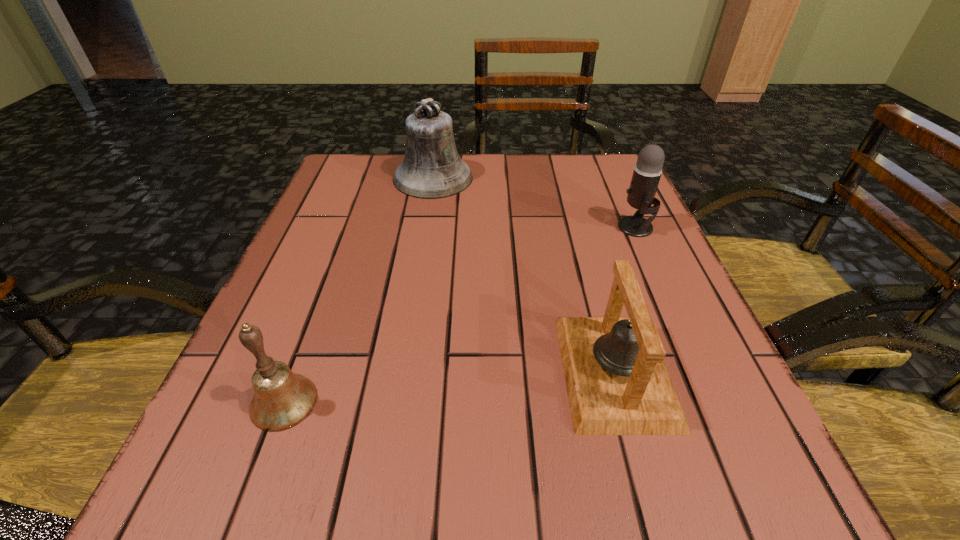
I want to click on vacant space at the near right corner of the desktop, so click(782, 513).

Find the location of a particular element. free space between the tallest bell and the leftmost object is located at coordinates (359, 290).

Image resolution: width=960 pixels, height=540 pixels. I want to click on free point between the third object from right to left and the leftmost bell, so click(359, 290).

You are a GUI agent. You are given a task and a screenshot of the screen. Output one action in this format:
    pyautogui.click(x=<x>, y=<y>)
    Task: Click on the vacant space that's between the second bell from right to left and the third nearest object
    
    Given the screenshot: What is the action you would take?
    pyautogui.click(x=535, y=202)

At what (x,y) coordinates should I click in order to perform the action: click on free point between the leftmost bell and the third nearest object. Please return your answer as a coordinate pair (x, y). The height and width of the screenshot is (540, 960). Looking at the image, I should click on (460, 315).

Locate an element on the screen. This screenshot has height=540, width=960. vacant space in between the leftmost bell and the microphone is located at coordinates (460, 315).

You are a GUI agent. You are given a task and a screenshot of the screen. Output one action in this format:
    pyautogui.click(x=<x>, y=<y>)
    Task: Click on the blank region between the microphone and the second bell from left to right
    Image resolution: width=960 pixels, height=540 pixels.
    Given the screenshot: What is the action you would take?
    pyautogui.click(x=535, y=202)

Identify the location of free space between the farthest bell and the third object from left to right. This screenshot has height=540, width=960. (524, 274).

Where is `free space between the rightmost bell and the leftmost object`? The width and height of the screenshot is (960, 540). free space between the rightmost bell and the leftmost object is located at coordinates (449, 387).

Locate an element on the screen. The width and height of the screenshot is (960, 540). the second closest object to the microphone is located at coordinates [x=432, y=168].